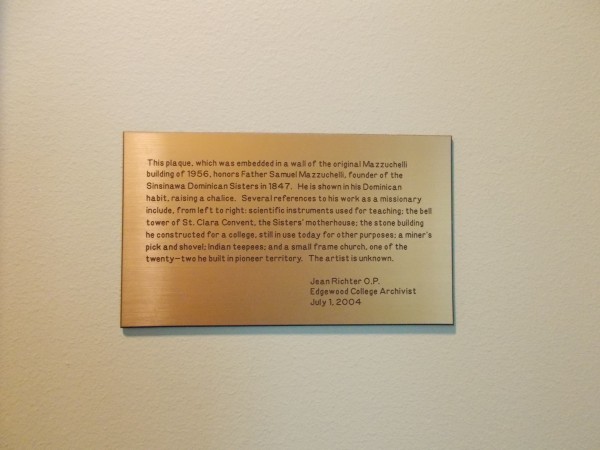
The height and width of the screenshot is (450, 600). Identify the location of wall. (519, 168).